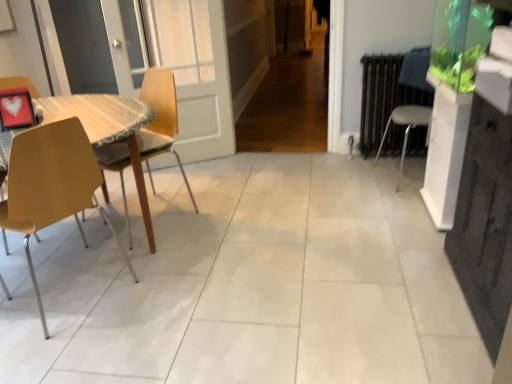
Question: Is white plastic chair at right, arranged as the 1th chair when viewed from the right, situated inside wooden at left, arranged as the second chair when viewed from the right, or outside?

Choices:
 (A) outside
 (B) inside

Answer: (A)

Question: From a real-world perspective, is white plastic chair at right, arranged as the 1th chair when viewed from the right, positioned above or below wooden at left, arranged as the second chair when viewed from the right?

Choices:
 (A) above
 (B) below

Answer: (B)

Question: Based on their relative distances, which object is farther from the white plastic chair at right, arranged as the 3th chair when viewed from the left?

Choices:
 (A) wooden at left, arranged as the second chair when viewed from the right
 (B) matte yellow chair at left, the 3th chair viewed from the right

Answer: (B)

Question: Based on their relative distances, which object is nearer to the matte yellow chair at left, placed as the 1th chair when sorted from left to right?

Choices:
 (A) white plastic chair at right, arranged as the 3th chair when viewed from the left
 (B) wooden at left, arranged as the second chair when viewed from the right

Answer: (B)